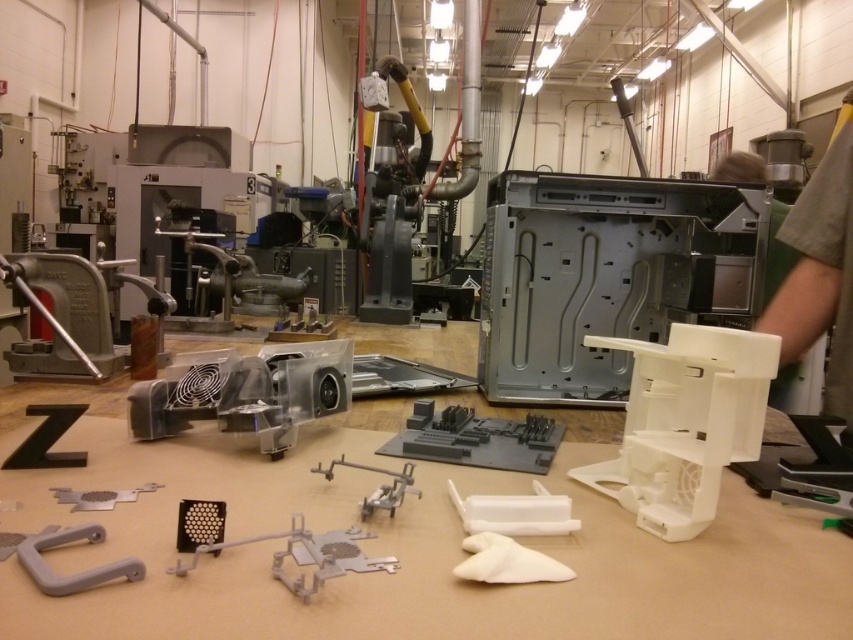
Is gray matte plastic at center wider than metallic gray bracket at lower left?

Correct, the width of gray matte plastic at center exceeds that of metallic gray bracket at lower left.

Can you confirm if gray matte plastic at center is positioned to the left of metallic gray bracket at lower left?

In fact, gray matte plastic at center is to the right of metallic gray bracket at lower left.

Who is more distant from viewer, (300, 545) or (103, 497)?

Positioned behind is point (103, 497).

I want to click on gray matte plastic at center, so click(x=305, y=556).

The height and width of the screenshot is (640, 853). What are the coordinates of `gray matte plastic at center` in the screenshot? It's located at (305, 556).

Can you confirm if gray matte plastic at center is bigger than gray matte plastic tool at center?

Yes, gray matte plastic at center is bigger than gray matte plastic tool at center.

Image resolution: width=853 pixels, height=640 pixels. What are the coordinates of `gray matte plastic at center` in the screenshot? It's located at (305, 556).

Between gray matte circuit board at center and gray matte plastic at center, which one is positioned lower?

gray matte plastic at center is lower down.

Does gray matte circuit board at center appear under gray matte plastic at center?

No, gray matte circuit board at center is not below gray matte plastic at center.

Which is behind, point (482, 426) or point (192, 566)?

The point (482, 426) is behind.

Image resolution: width=853 pixels, height=640 pixels. I want to click on gray matte circuit board at center, so click(476, 438).